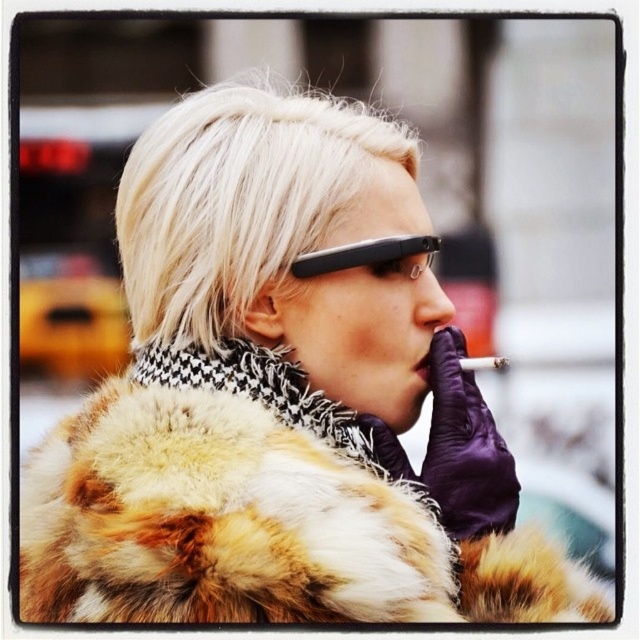
Question: Which of the following is the farthest from the observer?

Choices:
 (A) black plastic glasses at upper center
 (B) blonde fur at upper center

Answer: (B)

Question: Is fur coat at center bigger than blonde fur at upper center?

Choices:
 (A) yes
 (B) no

Answer: (A)

Question: Is fur coat at center below blonde fur at upper center?

Choices:
 (A) yes
 (B) no

Answer: (A)

Question: Which of these objects is positioned closest to the black plastic glasses at upper center?

Choices:
 (A) fur coat at center
 (B) blonde fur at upper center

Answer: (B)

Question: Which object is the closest to the fur coat at center?

Choices:
 (A) blonde fur at upper center
 (B) black plastic glasses at upper center

Answer: (B)

Question: Is fur coat at center below blonde fur at upper center?

Choices:
 (A) yes
 (B) no

Answer: (A)